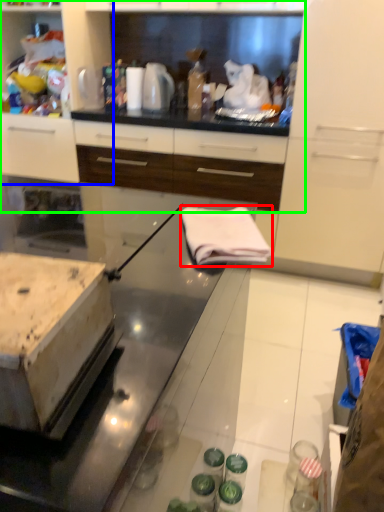
Question: Based on their relative distances, which object is farther from cloth (highlighted by a red box)? Choose from cabinetry (highlighted by a blue box) and cabinetry (highlighted by a green box).

Choices:
 (A) cabinetry
 (B) cabinetry

Answer: (A)